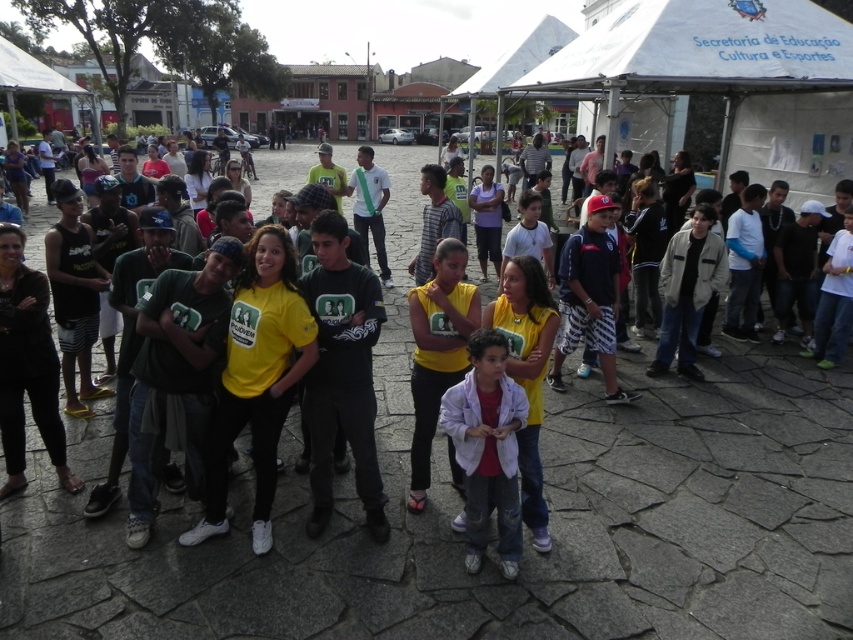
Where is `white matte jacket at center`? The width and height of the screenshot is (853, 640). white matte jacket at center is located at coordinates (486, 448).

Is point (476, 481) less distant than point (621, 394)?

Yes, point (476, 481) is in front of point (621, 394).

At what (x,y) coordinates should I click in order to perform the action: click on white matte jacket at center. Please return your answer as a coordinate pair (x, y). This screenshot has width=853, height=640. Looking at the image, I should click on (486, 448).

Where is `white matte jacket at center`? The height and width of the screenshot is (640, 853). white matte jacket at center is located at coordinates pyautogui.click(x=486, y=448).